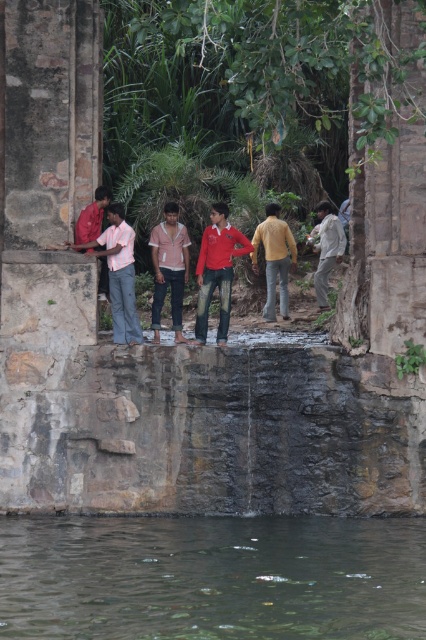
Question: Does clear water at lower center appear under light beige fabric shirt at right?

Choices:
 (A) yes
 (B) no

Answer: (A)

Question: Which object is positioned closest to the matte yellow shirt at center?

Choices:
 (A) light beige fabric shirt at right
 (B) clear water at lower center

Answer: (A)

Question: Is the position of matte red shirt at center less distant than that of striped cotton shirt at left?

Choices:
 (A) yes
 (B) no

Answer: (B)

Question: Which of these objects is positioned farthest from the light beige fabric shirt at right?

Choices:
 (A) striped cotton shirt at left
 (B) matte yellow shirt at center
 (C) pink cotton shirt at center

Answer: (A)

Question: Among these points, which one is nearest to the camera?

Choices:
 (A) (319, 227)
 (B) (175, 276)

Answer: (B)

Question: Is matte yellow shirt at center below light beige fabric shirt at right?

Choices:
 (A) no
 (B) yes

Answer: (B)